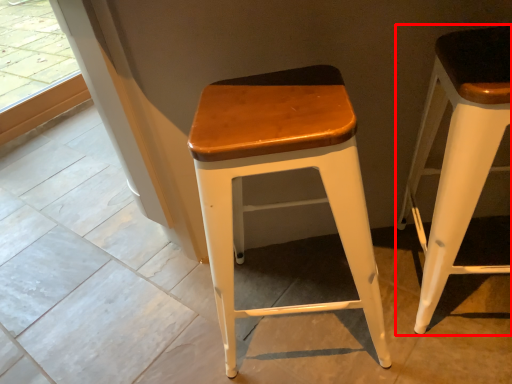
Question: Observing the image, what is the correct spatial positioning of stool (annotated by the red box) in reference to stool?

Choices:
 (A) right
 (B) left

Answer: (A)